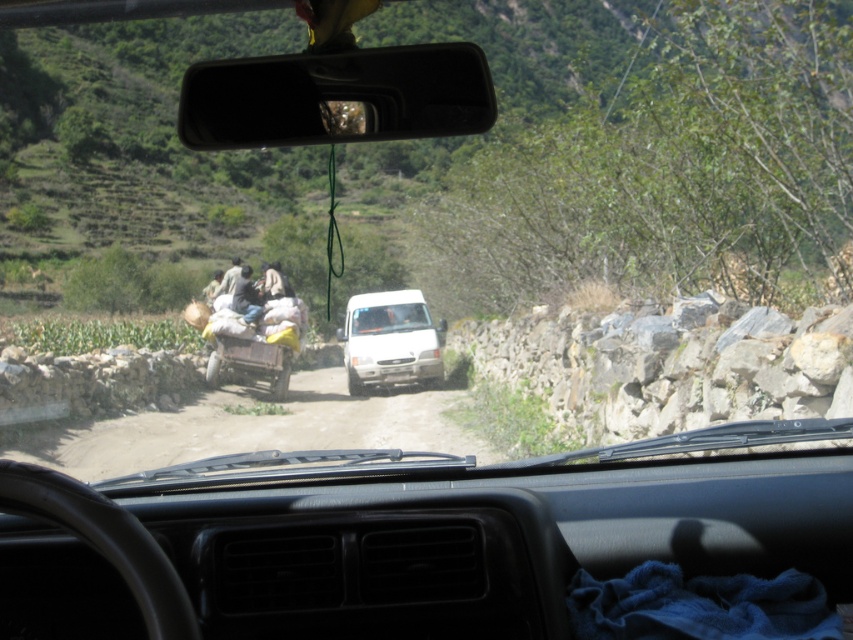
Does black plastic view mirror at center appear under dark gray fabric bag at center?

No, black plastic view mirror at center is not below dark gray fabric bag at center.

Can you confirm if black plastic view mirror at center is smaller than dark gray fabric bag at center?

Yes.

Locate an element on the screen. black plastic view mirror at center is located at coordinates (335, 97).

Identify the location of black plastic view mirror at center. (335, 97).

Is black plastic view mirror at center thinner than white matte van at center?

Indeed, black plastic view mirror at center has a lesser width compared to white matte van at center.

Measure the distance from black plastic view mirror at center to white matte van at center.

They are 21.07 meters apart.

Which is in front, point (462, 97) or point (405, 362)?

Point (462, 97) is more forward.

At what (x,y) coordinates should I click in order to perform the action: click on black plastic view mirror at center. Please return your answer as a coordinate pair (x, y). This screenshot has width=853, height=640. Looking at the image, I should click on (335, 97).

Who is more forward, (387,321) or (242,304)?

Point (242,304) is in front.

Does clear glass windshield at center appear over dark gray fabric bag at center?

Incorrect, clear glass windshield at center is not positioned above dark gray fabric bag at center.

Who is more forward, (x=415, y=326) or (x=244, y=278)?

Point (x=244, y=278) is in front.

This screenshot has height=640, width=853. In order to click on clear glass windshield at center in this screenshot , I will do `click(390, 317)`.